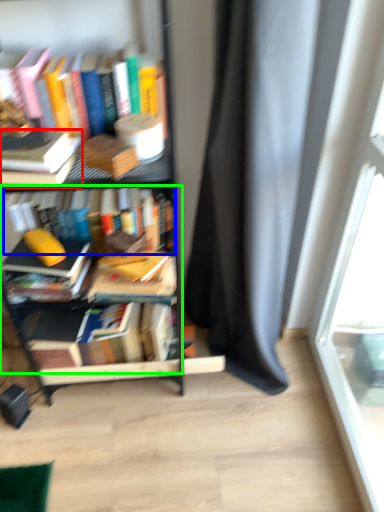
Question: Which object is positioned farthest from book (highlighted by a red box)? Select from book (highlighted by a blue box) and book (highlighted by a green box).

Choices:
 (A) book
 (B) book

Answer: (A)